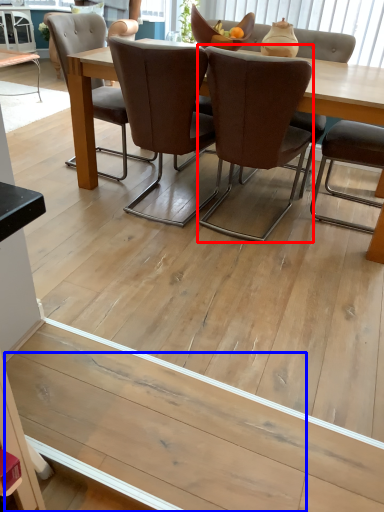
Question: Among these objects, which one is nearest to the camera, chair (highlighted by a red box) or plank (highlighted by a blue box)?

Choices:
 (A) chair
 (B) plank

Answer: (B)